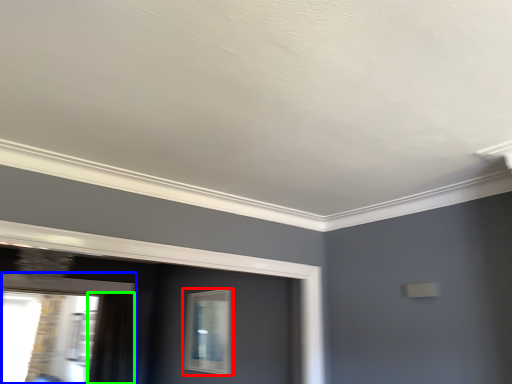
Question: Which is nearer to the window (highlighted by a red box)? window (highlighted by a blue box) or curtain (highlighted by a green box).

Choices:
 (A) window
 (B) curtain

Answer: (B)